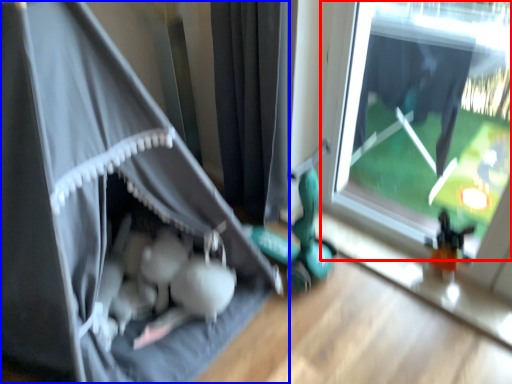
Question: Among these objects, which one is nearest to the camera, window (highlighted by a red box) or curtain (highlighted by a blue box)?

Choices:
 (A) window
 (B) curtain

Answer: (B)